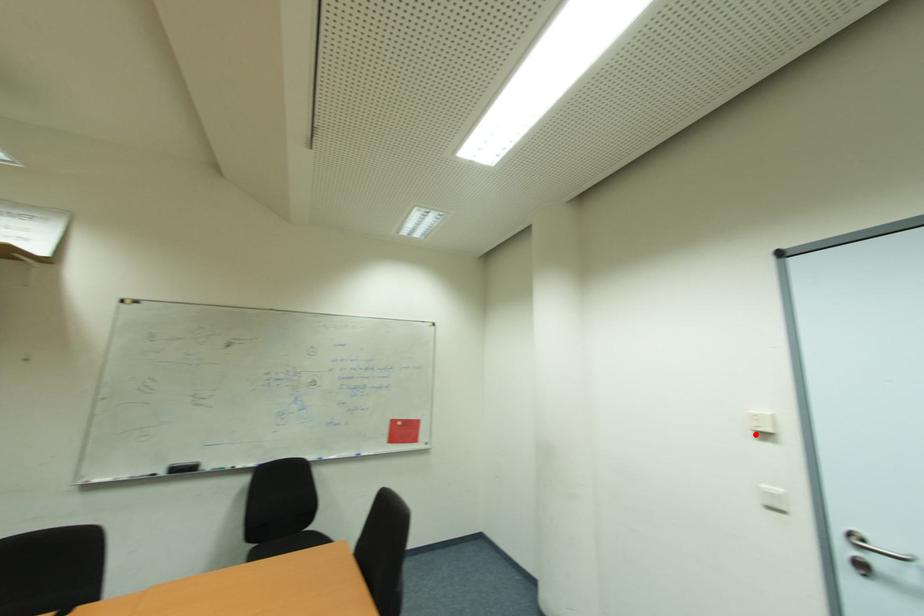
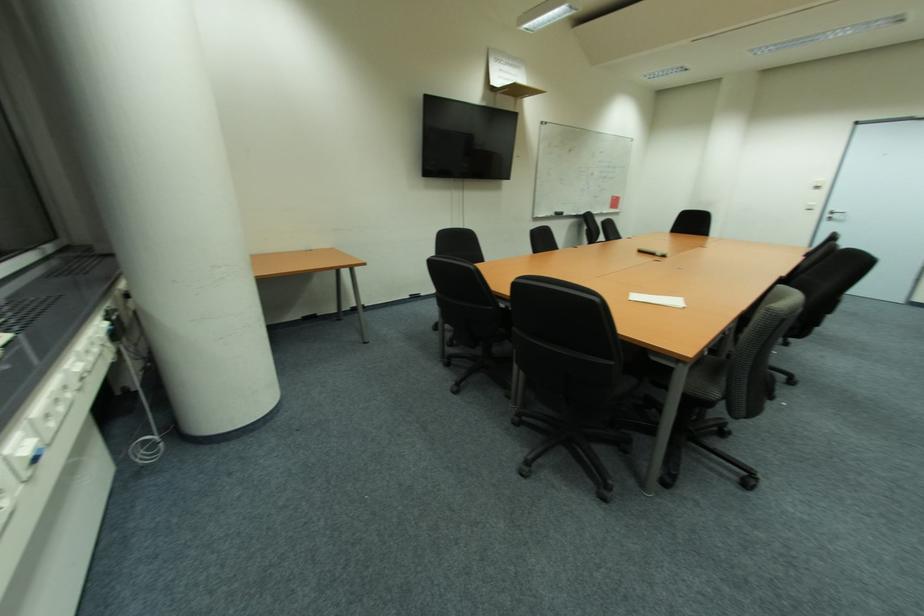
Question: I am providing you with two images of the same scene from different viewpoints. A red point is shown in image1. For the corresponding object point in image2, is it positioned nearer or farther from the camera?

Choices:
 (A) Nearer
 (B) Farther

Answer: (B)